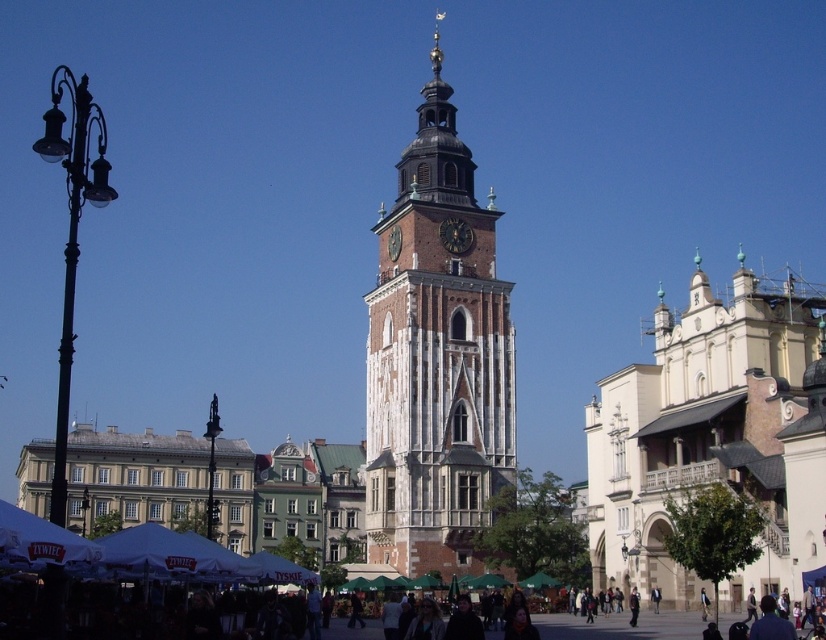
Question: Is stone clock tower at center thinner than dark brown stone clock at center?

Choices:
 (A) yes
 (B) no

Answer: (B)

Question: Is the position of stone clock tower at center more distant than that of white stone church at right?

Choices:
 (A) yes
 (B) no

Answer: (A)

Question: Which of these objects is positioned closest to the dark brown stone clock at center?

Choices:
 (A) stone clock tower at center
 (B) white stone church at right

Answer: (A)

Question: Which object is the farthest from the stone clock tower at center?

Choices:
 (A) dark brown stone clock at center
 (B) white stone church at right

Answer: (B)

Question: Which is nearer to the dark brown stone clock at center?

Choices:
 (A) white stone church at right
 (B) stone clock tower at center

Answer: (B)

Question: Can you confirm if stone clock tower at center is positioned above dark brown stone clock at center?

Choices:
 (A) yes
 (B) no

Answer: (B)